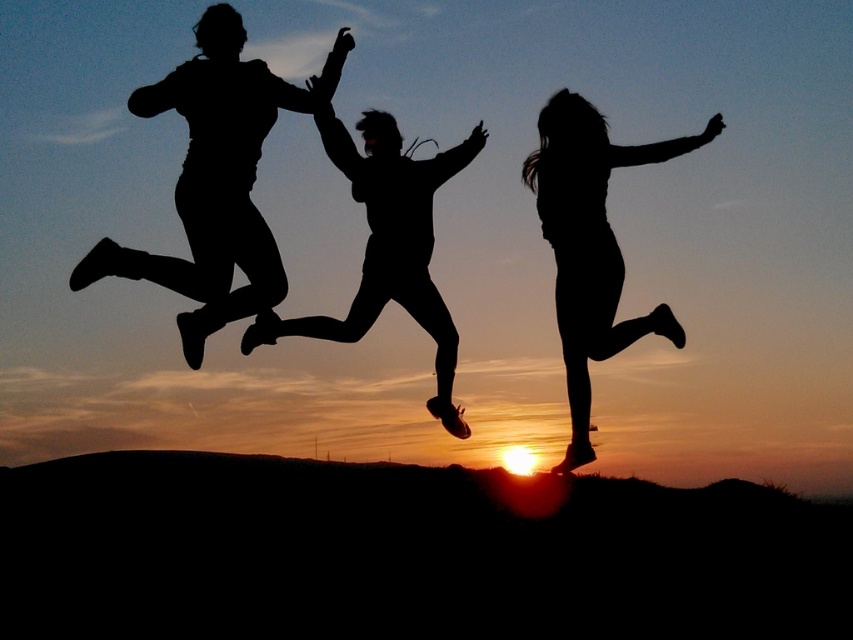
Question: Which object appears farthest from the camera in this image?

Choices:
 (A) black matte silhouette at center
 (B) black matte figure at center

Answer: (B)

Question: Can you confirm if black matte figure at center is thinner than black matte silhouette at center?

Choices:
 (A) no
 (B) yes

Answer: (B)

Question: Does black matte figure at center have a lesser width compared to black matte silhouette at center?

Choices:
 (A) no
 (B) yes

Answer: (B)

Question: Among these points, which one is farthest from the camera?

Choices:
 (A) (531, 180)
 (B) (380, 285)

Answer: (A)

Question: Can you confirm if black matte figure at center is positioned to the left of black matte silhouette at center?

Choices:
 (A) no
 (B) yes

Answer: (A)